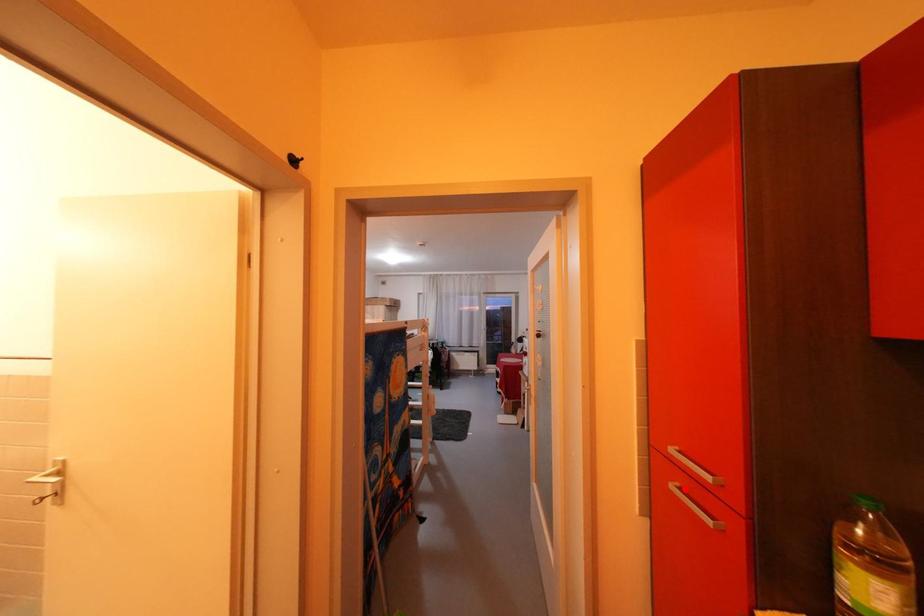
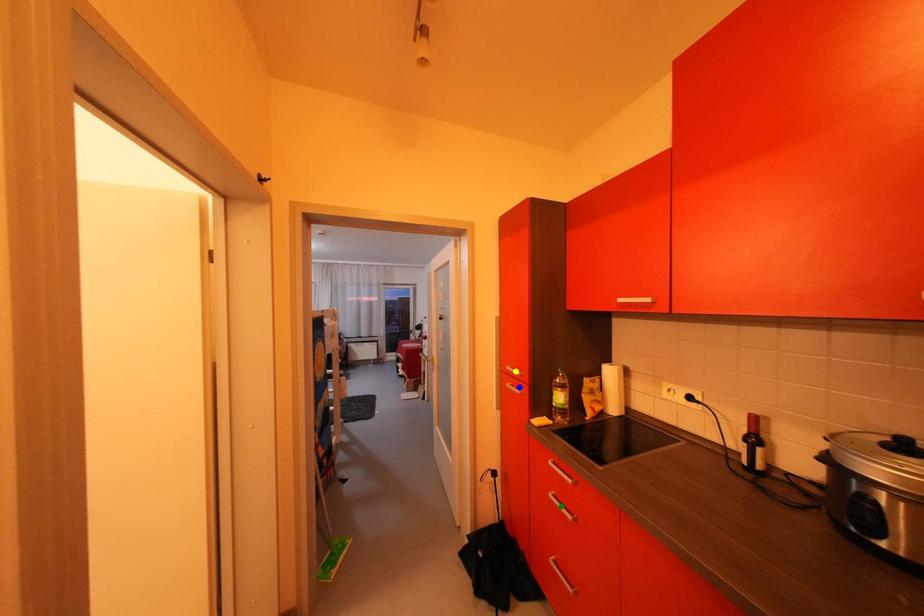
Question: I am providing you with two images of the same scene from different viewpoints. A red point is marked on the first image. You are given multiple points on the second image. Which point in image 2 is actually the same real-world point as the red point in image 1?

Choices:
 (A) blue point
 (B) green point
 (C) yellow point

Answer: (A)